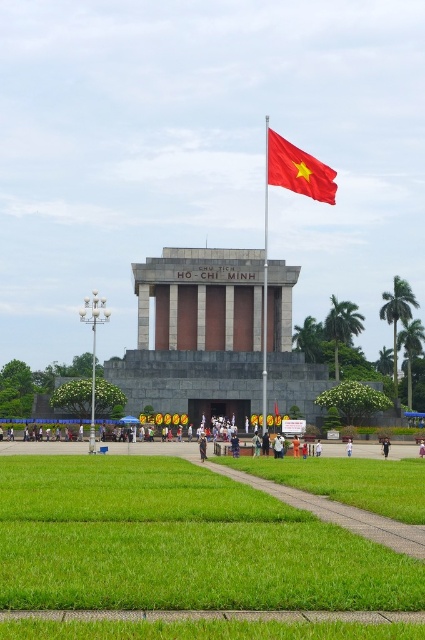
You are a tour guide leading a group to the monument. You want to inform your group about the distance between the green grass at center and the red fabric flag at upper center. What do you tell them?

The green grass at center is 43.42 meters away from the red fabric flag at upper center.

You are standing in front of the monument and want to take a photo of both the red fabric flag at upper center and the black fabric person at center. Which object should you focus on first to ensure both are in the frame?

You should focus on the black fabric person at center first because the red fabric flag at upper center is located above it, so adjusting the camera angle to include the person will naturally include the flag as well.